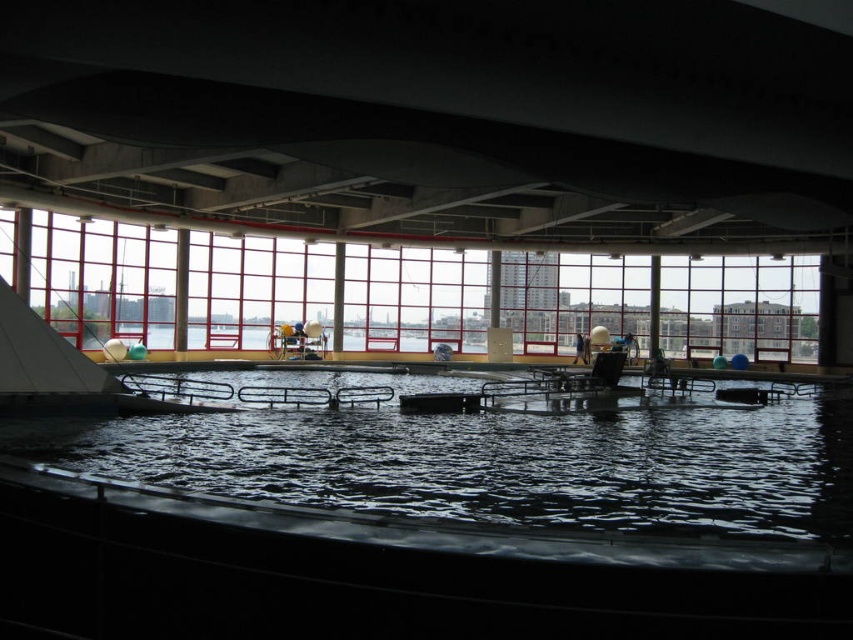
Question: Can you confirm if clear glass windows at center is positioned below dark blue fabric person at center?

Choices:
 (A) yes
 (B) no

Answer: (B)

Question: Can you confirm if clear plastic water at center is positioned below clear glass windows at center?

Choices:
 (A) yes
 (B) no

Answer: (A)

Question: Which object is positioned closest to the dark blue fabric person at center?

Choices:
 (A) clear glass windows at center
 (B) clear plastic water at center

Answer: (A)

Question: Can you confirm if clear plastic water at center is wider than dark blue fabric person at center?

Choices:
 (A) no
 (B) yes

Answer: (B)

Question: Estimate the real-world distances between objects in this image. Which object is closer to the clear glass windows at center?

Choices:
 (A) clear plastic water at center
 (B) light brown wooden chair at center

Answer: (B)

Question: Which of the following is the farthest from the observer?

Choices:
 (A) clear glass windows at center
 (B) dark blue fabric person at center
 (C) light brown wooden chair at center

Answer: (C)